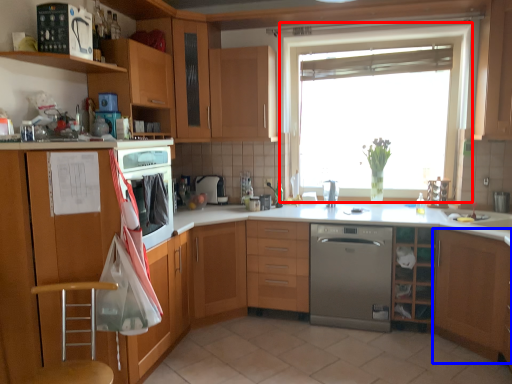
Question: Which point is further to the camera, window (highlighted by a red box) or cabinetry (highlighted by a blue box)?

Choices:
 (A) window
 (B) cabinetry

Answer: (A)